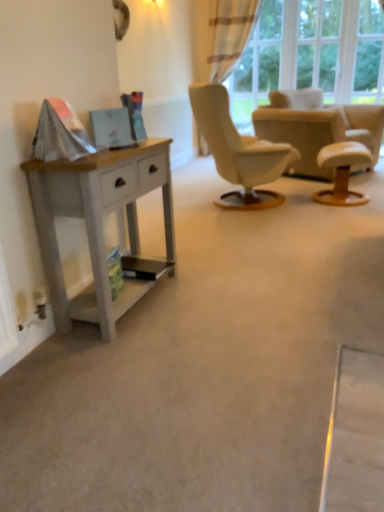
Measure the distance between point (273, 122) and camera.

Point (273, 122) and camera are 4.38 meters apart.

Where is `plaid fabric curtain at upper right`? This screenshot has width=384, height=512. plaid fabric curtain at upper right is located at coordinates (221, 35).

Is white wood desk at left aimed at plaid fabric curtain at upper right?

No, white wood desk at left is not turned towards plaid fabric curtain at upper right.

The height and width of the screenshot is (512, 384). Identify the location of desk that is on the left side of plaid fabric curtain at upper right. (101, 225).

Considering the relative sizes of white wood desk at left and plaid fabric curtain at upper right in the image provided, is white wood desk at left bigger than plaid fabric curtain at upper right?

No.

Does white wood desk at left have a lesser width compared to plaid fabric curtain at upper right?

Yes, white wood desk at left is thinner than plaid fabric curtain at upper right.

Considering the relative positions of white leather stool at right and transparent glass door at upper right in the image provided, is white leather stool at right to the left or to the right of transparent glass door at upper right?

Based on their positions, white leather stool at right is located to the right of transparent glass door at upper right.

Which of these two, white leather stool at right or transparent glass door at upper right, is smaller?

Smaller between the two is white leather stool at right.

Which is behind, point (325, 166) or point (269, 10)?

Point (269, 10)

Considering the relative sizes of white wood desk at left and beige fabric armchair at center in the image provided, is white wood desk at left thinner than beige fabric armchair at center?

Yes, white wood desk at left is thinner than beige fabric armchair at center.

How many degrees apart are the facing directions of white wood desk at left and beige fabric armchair at center?

The angle between the facing direction of white wood desk at left and the facing direction of beige fabric armchair at center is 26.6 degrees.

Between white wood desk at left and beige fabric armchair at center, which one has smaller size?

With smaller size is white wood desk at left.

Can you see white wood desk at left touching beige fabric armchair at center?

No, white wood desk at left is not making contact with beige fabric armchair at center.

From the image's perspective, who appears lower, white wood desk at left or white leather stool at right?

white wood desk at left.

Which is in front, white wood desk at left or white leather stool at right?

white wood desk at left is more forward.

Can you confirm if white wood desk at left is bigger than white leather stool at right?

Yes, white wood desk at left is bigger than white leather stool at right.

Consider the image. Is white wood desk at left aimed at white leather stool at right?

No, white wood desk at left is not facing towards white leather stool at right.

Is transparent glass door at upper right facing towards white wood desk at left?

Yes, transparent glass door at upper right is facing white wood desk at left.

From a real-world perspective, is transparent glass door at upper right under white wood desk at left?

No, from a real-world perspective, transparent glass door at upper right is not beneath white wood desk at left.

Does transparent glass door at upper right lie behind white wood desk at left?

Yes, the depth of transparent glass door at upper right is greater than that of white wood desk at left.

Does beige fabric armchair at center turn towards transparent glass door at upper right?

No, beige fabric armchair at center does not turn towards transparent glass door at upper right.

Is beige fabric armchair at center completely or partially outside of transparent glass door at upper right?

beige fabric armchair at center lies outside transparent glass door at upper right's area.

From the image's perspective, between beige fabric armchair at center and transparent glass door at upper right, which one is located above?

From the image's view, transparent glass door at upper right is above.

From a real-world perspective, is beige fabric armchair at center above or below transparent glass door at upper right?

Clearly, from a real-world perspective, beige fabric armchair at center is below transparent glass door at upper right.

Is white leather stool at right turned away from plaid fabric curtain at upper right?

No, white leather stool at right is not facing away from plaid fabric curtain at upper right.

The width and height of the screenshot is (384, 512). I want to click on stool in front of the plaid fabric curtain at upper right, so click(x=342, y=172).

Is plaid fabric curtain at upper right surrounded by white leather stool at right?

No, white leather stool at right does not contain plaid fabric curtain at upper right.

Which object is more forward, white leather stool at right or plaid fabric curtain at upper right?

white leather stool at right is more forward.

The height and width of the screenshot is (512, 384). I want to click on desk below the plaid fabric curtain at upper right (from a real-world perspective), so click(x=101, y=225).

Where is `stool lying in front of the transparent glass door at upper right`? This screenshot has width=384, height=512. stool lying in front of the transparent glass door at upper right is located at coordinates (342, 172).

From the image, which object appears to be nearer to white wood desk at left, beige fabric armchair at center or transparent glass door at upper right?

beige fabric armchair at center.

When comparing their distances from white leather stool at right, does transparent glass door at upper right or plaid fabric curtain at upper right seem closer?

transparent glass door at upper right is positioned closer to the anchor white leather stool at right.

Based on their spatial positions, is beige fabric armchair at center or plaid fabric curtain at upper right closer to white leather stool at right?

beige fabric armchair at center is closer to white leather stool at right.

Estimate the real-world distances between objects in this image. Which object is closer to plaid fabric curtain at upper right, transparent glass door at upper right or white leather stool at right?

transparent glass door at upper right lies closer to plaid fabric curtain at upper right than the other object.

When comparing their distances from plaid fabric curtain at upper right, does transparent glass door at upper right or white wood desk at left seem closer?

transparent glass door at upper right lies closer to plaid fabric curtain at upper right than the other object.

Which object lies nearer to the anchor point white wood desk at left, transparent glass door at upper right or beige fabric armchair at center?

beige fabric armchair at center is closer to white wood desk at left.

From the image, which object appears to be farther from transparent glass door at upper right, white wood desk at left or plaid fabric curtain at upper right?

Based on the image, white wood desk at left appears to be further to transparent glass door at upper right.

From the image, which object appears to be nearer to transparent glass door at upper right, beige fabric armchair at center or white leather stool at right?

beige fabric armchair at center is closer to transparent glass door at upper right.

I want to click on chair between white wood desk at left and plaid fabric curtain at upper right in the front-back direction, so click(x=317, y=127).

You are a GUI agent. You are given a task and a screenshot of the screen. Output one action in this format:
    pyautogui.click(x=<x>, y=<y>)
    Task: Click on the chair between white leather stool at right and plaid fabric curtain at upper right from front to back
    The height and width of the screenshot is (512, 384).
    Given the screenshot: What is the action you would take?
    pyautogui.click(x=317, y=127)

You are a GUI agent. You are given a task and a screenshot of the screen. Output one action in this format:
    pyautogui.click(x=<x>, y=<y>)
    Task: Click on the curtain between white wood desk at left and transparent glass door at upper right in the front-back direction
    This screenshot has height=512, width=384.
    Given the screenshot: What is the action you would take?
    pyautogui.click(x=221, y=35)

Where is `stool between white wood desk at left and plaid fabric curtain at upper right from front to back`? This screenshot has width=384, height=512. stool between white wood desk at left and plaid fabric curtain at upper right from front to back is located at coordinates (342, 172).